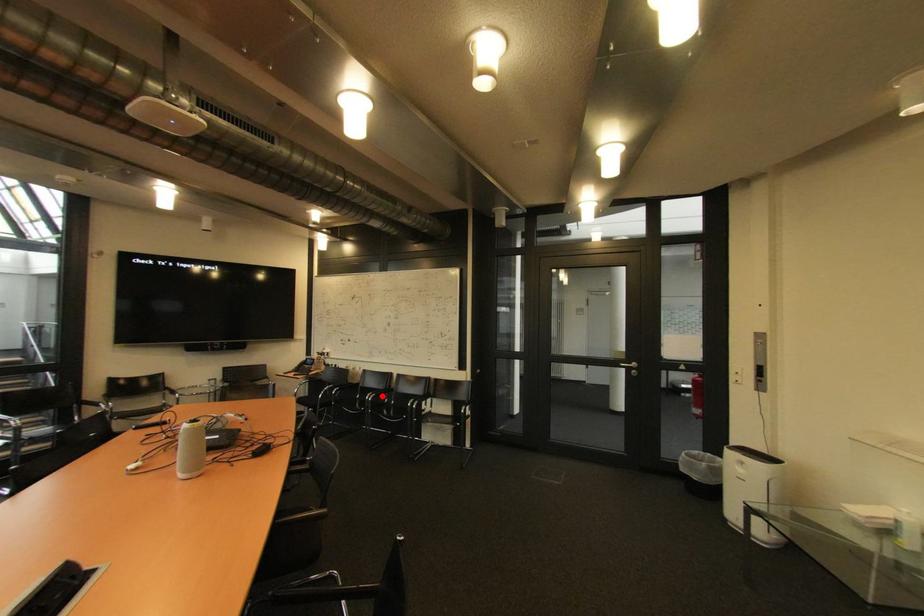
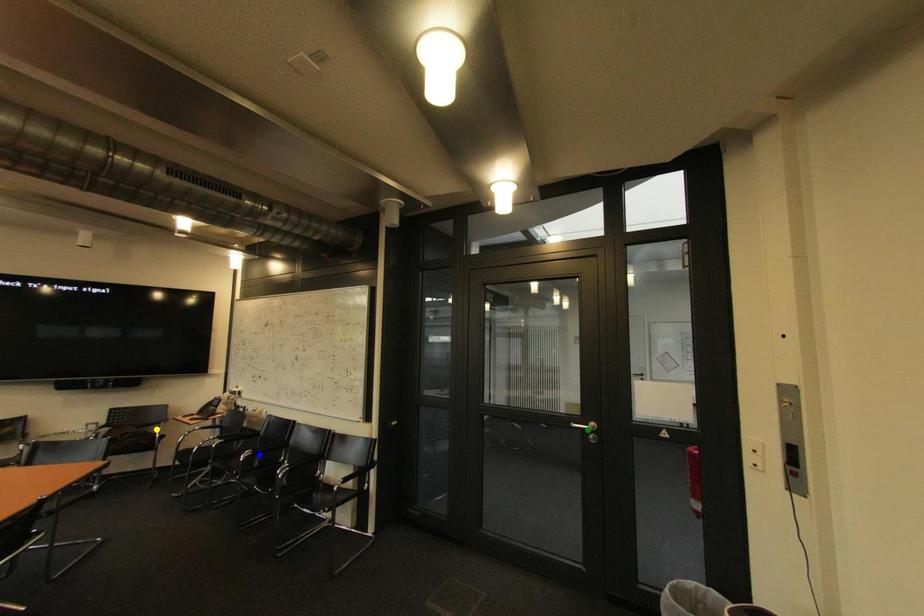
Question: I am providing you with two images of the same scene from different viewpoints. A red point is marked on the first image. You are given multiple points on the second image. Which point in image 2 represents the same 3d spot as the red point in image 1?

Choices:
 (A) yellow point
 (B) green point
 (C) blue point

Answer: (C)